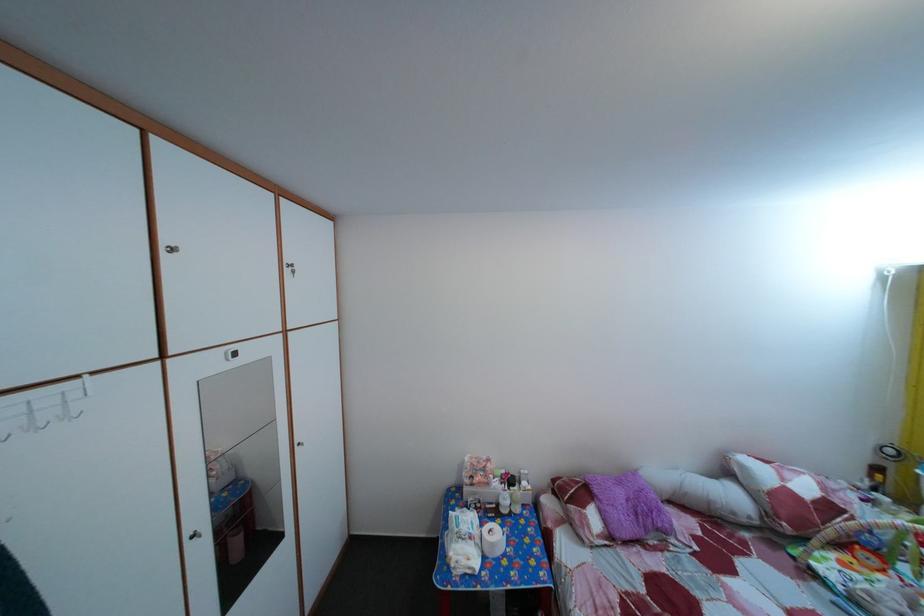
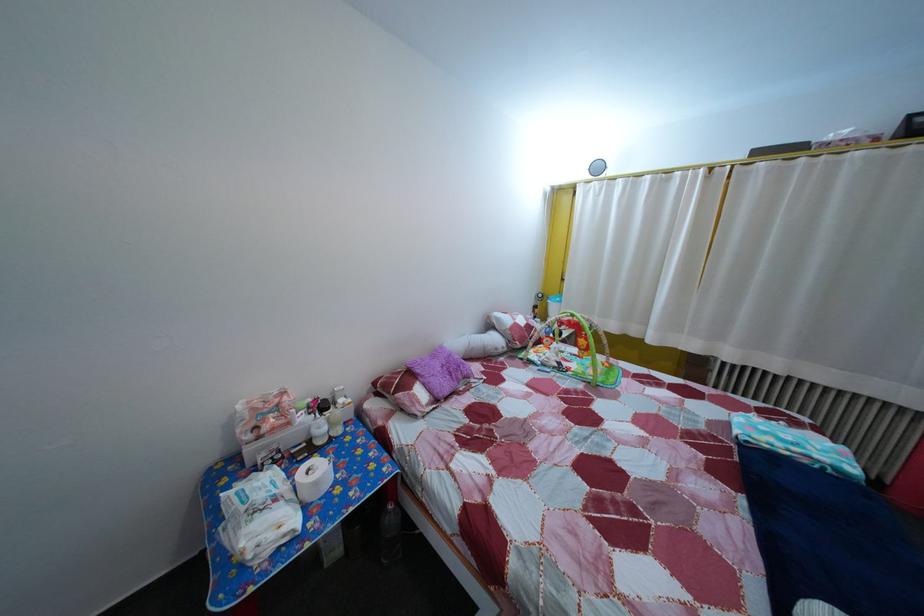
In the second image, find the point that corresponds to pixel 610 517 in the first image.

(433, 392)